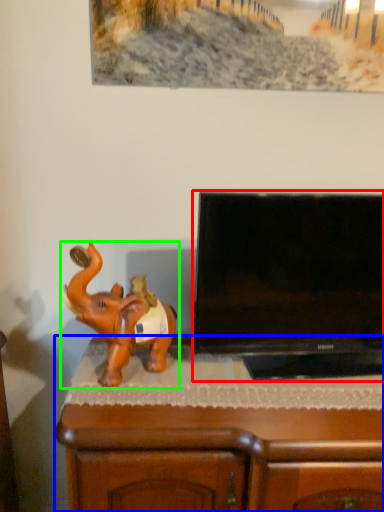
Question: Which object is positioned farthest from television (highlighted by a red box)? Select from furniture (highlighted by a blue box) and elephant (highlighted by a green box).

Choices:
 (A) furniture
 (B) elephant

Answer: (B)